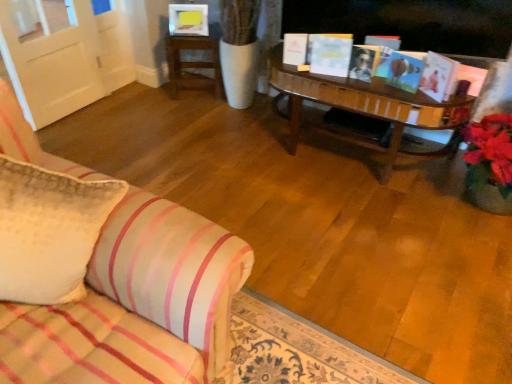
You are a GUI agent. You are given a task and a screenshot of the screen. Output one action in this format:
    pyautogui.click(x=<x>, y=<y>)
    Task: Click on the blank area beneath wooden table at upper center (from a real-world perspective)
    The image size is (512, 384).
    Given the screenshot: What is the action you would take?
    pyautogui.click(x=196, y=96)